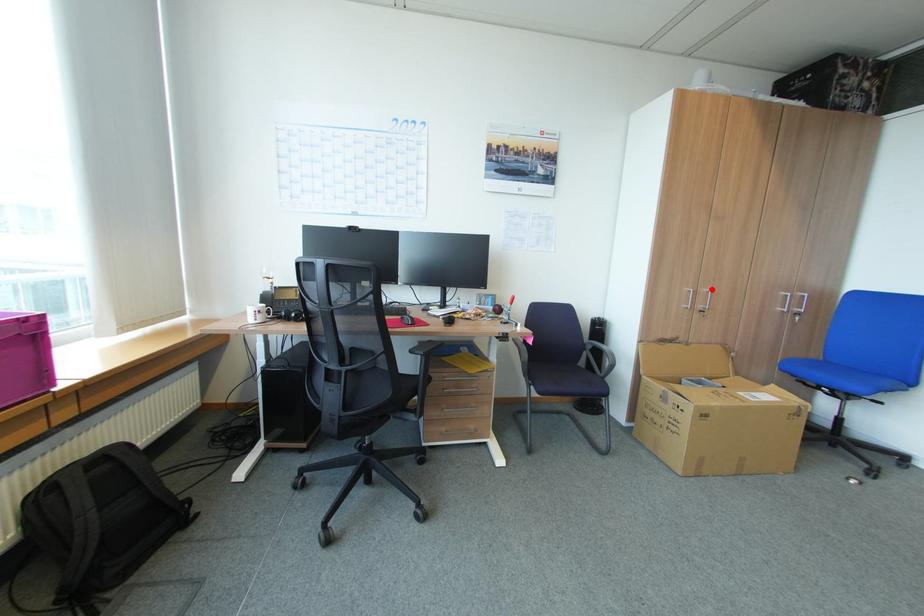
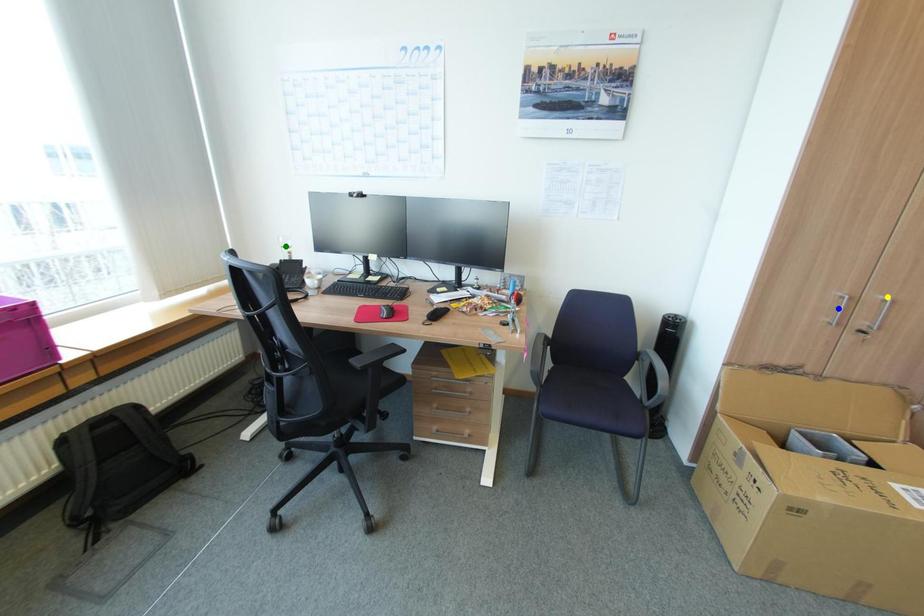
Question: I am providing you with two images of the same scene from different viewpoints. A red point is marked on the first image. You are given multiple points on the second image. Which mark in image 2 goes with the point in image 1?

Choices:
 (A) yellow point
 (B) blue point
 (C) green point

Answer: (A)